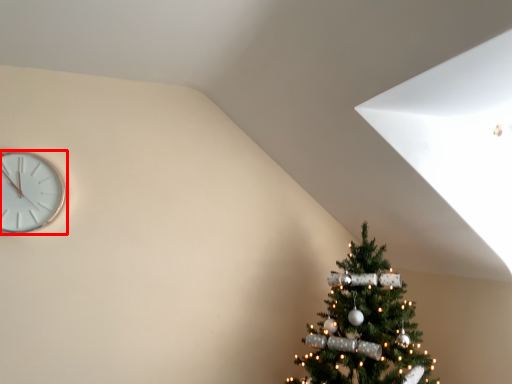
Question: Observing the image, what is the correct spatial positioning of wall clock (annotated by the red box) in reference to christmas tree?

Choices:
 (A) left
 (B) right

Answer: (A)